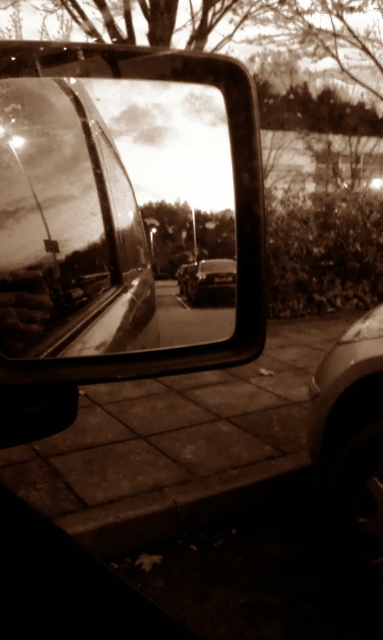
Does metallic car mirror at upper left have a lesser height compared to shiny silver car at center?

In fact, metallic car mirror at upper left may be taller than shiny silver car at center.

Does metallic car mirror at upper left appear on the left side of shiny silver car at center?

Indeed, metallic car mirror at upper left is positioned on the left side of shiny silver car at center.

Which is behind, point (163, 196) or point (211, 259)?

Positioned behind is point (211, 259).

At what (x,y) coordinates should I click in order to perform the action: click on metallic car mirror at upper left. Please return your answer as a coordinate pair (x, y). Image resolution: width=383 pixels, height=640 pixels. Looking at the image, I should click on (109, 212).

Is metallic car mirror at upper left smaller than shiny black tire at lower right?

Yes, metallic car mirror at upper left is smaller than shiny black tire at lower right.

Does point (212, 99) come farther from viewer compared to point (332, 388)?

No, it is in front of (332, 388).

Locate an element on the screen. This screenshot has height=640, width=383. metallic car mirror at upper left is located at coordinates (109, 212).

How far apart are shiny black tire at lower right and shiny silver car at center?

shiny black tire at lower right and shiny silver car at center are 1.46 meters apart from each other.

Between shiny black tire at lower right and shiny silver car at center, which one is positioned lower?

shiny black tire at lower right

From the picture: Measure the distance between shiny black tire at lower right and camera.

shiny black tire at lower right and camera are 2.16 meters apart from each other.

Identify the location of shiny black tire at lower right. (351, 433).